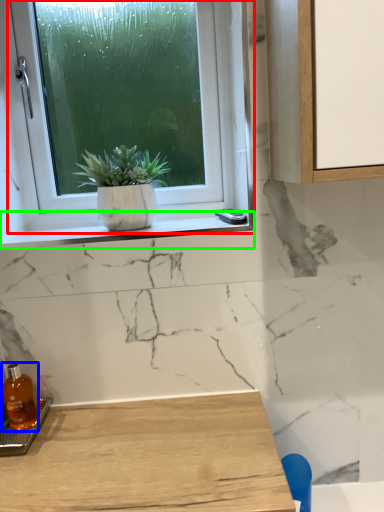
Question: Which object is positioned closest to window (highlighted by a red box)? Select from bottle (highlighted by a blue box) and window sill (highlighted by a green box).

Choices:
 (A) bottle
 (B) window sill

Answer: (B)